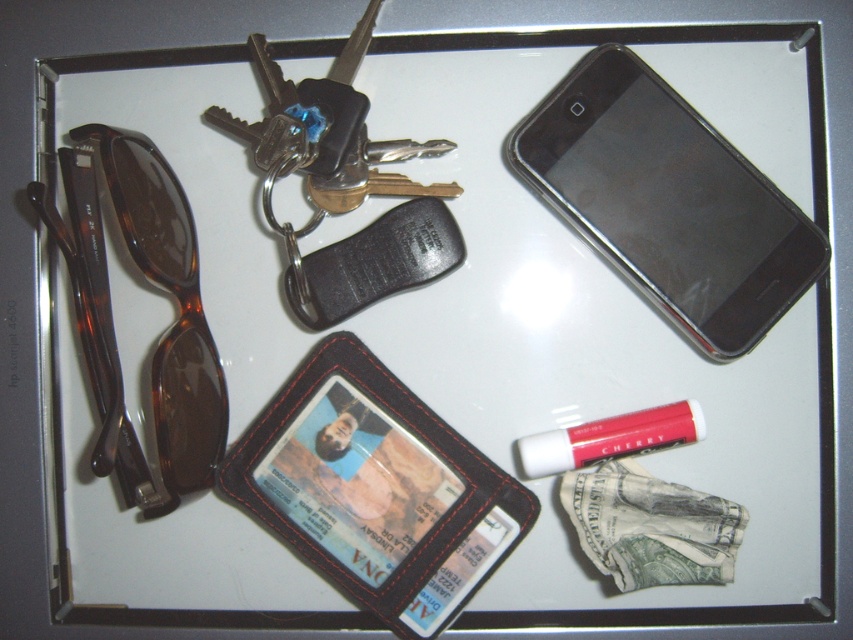
Is point (677, 316) behind point (595, 451)?

No, (677, 316) is in front of (595, 451).

Who is positioned more to the right, black plastic smartphone at upper right or matte cherry lipstick at lower right?

From the viewer's perspective, black plastic smartphone at upper right appears more on the right side.

Describe the element at coordinates (668, 200) in the screenshot. I see `black plastic smartphone at upper right` at that location.

Identify the location of black plastic smartphone at upper right. tap(668, 200).

Which is above, tortoiseshell plastic goggles at left or matte cherry lipstick at lower right?

tortoiseshell plastic goggles at left is above.

Is tortoiseshell plastic goggles at left shorter than matte cherry lipstick at lower right?

Incorrect, tortoiseshell plastic goggles at left's height does not fall short of matte cherry lipstick at lower right's.

Who is more distant from viewer, [186,416] or [633,435]?

The point [633,435] is behind.

Identify the location of tortoiseshell plastic goggles at left. (169, 328).

Can you confirm if black plastic smartphone at upper right is smaller than tortoiseshell plastic goggles at left?

Indeed, black plastic smartphone at upper right has a smaller size compared to tortoiseshell plastic goggles at left.

Is black plastic smartphone at upper right positioned at the back of tortoiseshell plastic goggles at left?

Yes, it is.

Describe the element at coordinates (668, 200) in the screenshot. I see `black plastic smartphone at upper right` at that location.

You are a GUI agent. You are given a task and a screenshot of the screen. Output one action in this format:
    pyautogui.click(x=<x>, y=<y>)
    Task: Click on the black plastic smartphone at upper right
    The width and height of the screenshot is (853, 640).
    Given the screenshot: What is the action you would take?
    pyautogui.click(x=668, y=200)